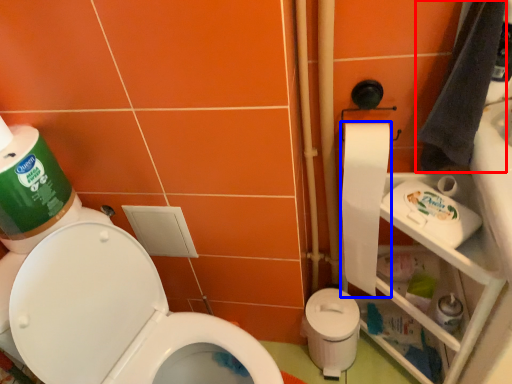
Question: Which object appears closest to the camera in this image, hand towel (highlighted by a red box) or toilet paper (highlighted by a blue box)?

Choices:
 (A) hand towel
 (B) toilet paper

Answer: (A)